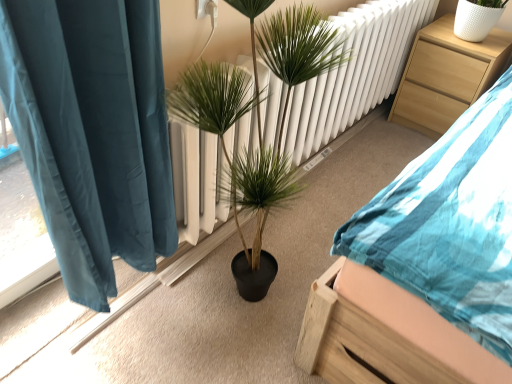
Question: Is green leafy plant at center far from wooden bed at center?

Choices:
 (A) no
 (B) yes

Answer: (A)

Question: Considering the relative sizes of green leafy plant at center and wooden bed at center in the image provided, is green leafy plant at center thinner than wooden bed at center?

Choices:
 (A) no
 (B) yes

Answer: (B)

Question: Is green leafy plant at center not inside wooden bed at center?

Choices:
 (A) yes
 (B) no

Answer: (A)

Question: Is green leafy plant at center in contact with wooden bed at center?

Choices:
 (A) no
 (B) yes

Answer: (A)

Question: Is green leafy plant at center to the right of wooden bed at center from the viewer's perspective?

Choices:
 (A) yes
 (B) no

Answer: (B)

Question: Is green leafy plant at center shorter than wooden bed at center?

Choices:
 (A) yes
 (B) no

Answer: (B)

Question: Is light wood nightstand at upper right aimed at wooden bed at center?

Choices:
 (A) yes
 (B) no

Answer: (B)

Question: From a real-world perspective, does light wood nightstand at upper right sit lower than wooden bed at center?

Choices:
 (A) no
 (B) yes

Answer: (B)

Question: Are light wood nightstand at upper right and wooden bed at center making contact?

Choices:
 (A) no
 (B) yes

Answer: (A)

Question: Considering the relative sizes of light wood nightstand at upper right and wooden bed at center in the image provided, is light wood nightstand at upper right taller than wooden bed at center?

Choices:
 (A) no
 (B) yes

Answer: (A)

Question: Can you confirm if light wood nightstand at upper right is thinner than wooden bed at center?

Choices:
 (A) yes
 (B) no

Answer: (A)

Question: Is light wood nightstand at upper right at the left side of wooden bed at center?

Choices:
 (A) no
 (B) yes

Answer: (A)

Question: Does green leafy plant at center contain light wood nightstand at upper right?

Choices:
 (A) no
 (B) yes

Answer: (A)